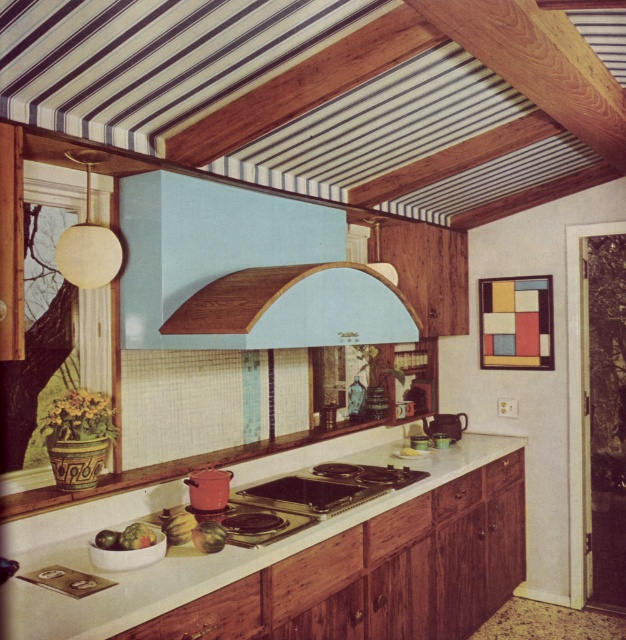
Who is more forward, [367,332] or [244,504]?

Point [244,504] is more forward.

In the scene shown: Does wooden/textured exhaust hood at center have a lesser height compared to shiny silver stove at center?

No, wooden/textured exhaust hood at center is not shorter than shiny silver stove at center.

Locate an element on the screen. wooden/textured exhaust hood at center is located at coordinates (299, 307).

Where is `wooden/textured exhaust hood at center`? wooden/textured exhaust hood at center is located at coordinates (299, 307).

Between light blue wood exhaust hood at center and white glossy countertop at center, which one has more height?

Standing taller between the two is light blue wood exhaust hood at center.

Does point (285, 220) lie behind point (322, 529)?

Yes, point (285, 220) is farther from viewer.

Where is `light blue wood exhaust hood at center`? This screenshot has width=626, height=640. light blue wood exhaust hood at center is located at coordinates (244, 272).

Consider the image. Between metallic silver stove at center and green matte apple at center, which one has more height?

green matte apple at center is taller.

Is metallic silver stove at center below green matte apple at center?

Yes, metallic silver stove at center is below green matte apple at center.

Who is more forward, [307,492] or [205,544]?

Point [205,544] is in front.

Locate an element on the screen. This screenshot has width=626, height=640. metallic silver stove at center is located at coordinates (329, 486).